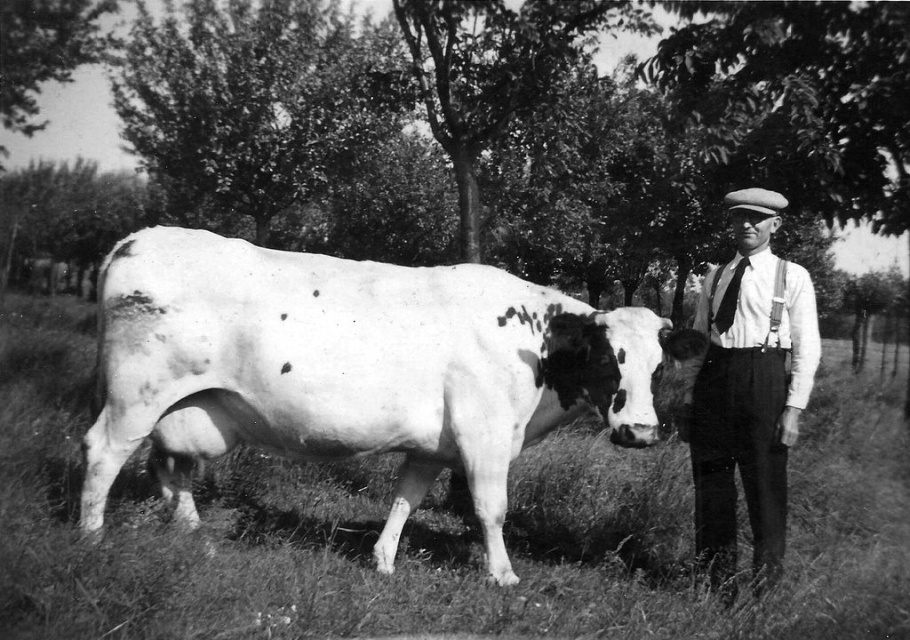
Who is taller, speckled white cow at center or white striped shirt at right?

Standing taller between the two is white striped shirt at right.

Is speckled white cow at center wider than white striped shirt at right?

Indeed, speckled white cow at center has a greater width compared to white striped shirt at right.

At what (x,y) coordinates should I click in order to perform the action: click on speckled white cow at center. Please return your answer as a coordinate pair (x, y). The width and height of the screenshot is (910, 640). Looking at the image, I should click on (349, 369).